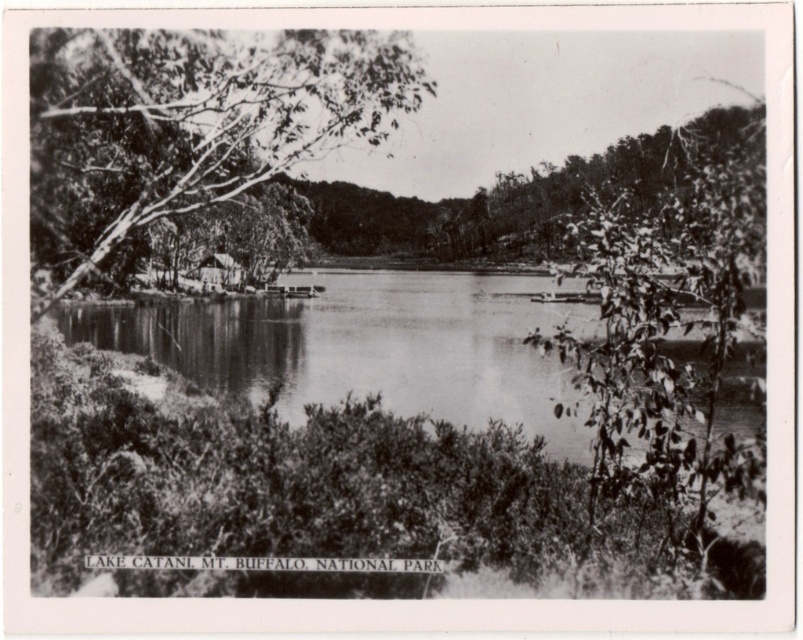
Does smooth bark tree at left have a larger size compared to wooden cabin at center?

Indeed, smooth bark tree at left has a larger size compared to wooden cabin at center.

Does smooth bark tree at left come behind wooden cabin at center?

No, it is in front of wooden cabin at center.

This screenshot has width=803, height=640. What are the coordinates of `smooth bark tree at left` in the screenshot? It's located at (190, 124).

Is smooth bark tree at left in front of smooth water at center?

Yes, it is in front of smooth water at center.

Is smooth bark tree at left taller than smooth water at center?

Incorrect, smooth bark tree at left's height is not larger of smooth water at center's.

Which is behind, point (278, 161) or point (433, 288)?

The point (433, 288) is more distant.

Image resolution: width=803 pixels, height=640 pixels. I want to click on smooth bark tree at left, so click(x=190, y=124).

Does smooth water at center have a lesser width compared to wooden cabin at center?

In fact, smooth water at center might be wider than wooden cabin at center.

How much distance is there between smooth water at center and wooden cabin at center?

smooth water at center is 16.55 meters from wooden cabin at center.

Between point (161, 348) and point (206, 260), which one is positioned in front?

Point (161, 348) is more forward.

Identify the location of smooth water at center. This screenshot has height=640, width=803. (369, 346).